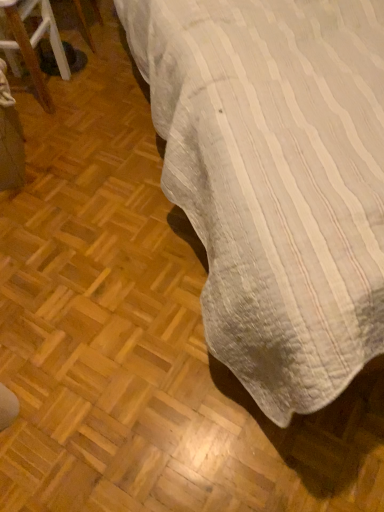
Locate an element on the screen. The width and height of the screenshot is (384, 512). vacant space to the right of black fabric bag at left is located at coordinates (104, 91).